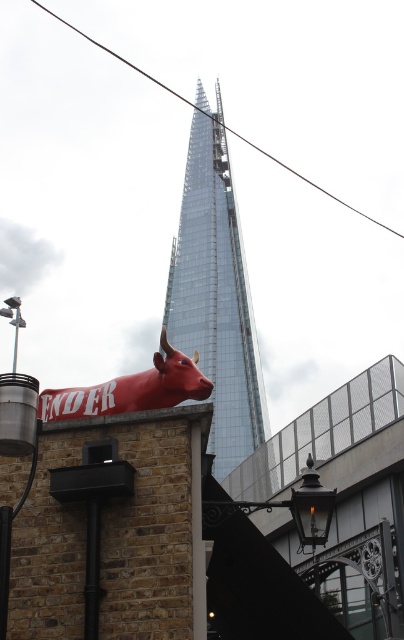
You are standing at the base of the transparent glass skyscraper at center. Looking up, you notice a point marked at coordinates (216, 291). What does this point represent?

The point at coordinates (216, 291) marks the transparent glass skyscraper at center.

You are standing in front of the transparent glass skyscraper at center. If you want to take a photo of the entire building without moving your position, will you be able to capture it all in one frame?

The transparent glass skyscraper at center is 21.14 meters away from the camera. Since the question does not provide information about the camera sensor size or lens focal length, it is impossible to determine if the entire building can be captured in one frame without moving your position.

You are an architect standing at the base of the transparent glass skyscraper at center and want to take a photo of the shiny red bull at lower left. Which object should you move closer to in order to capture both in the same frame?

You should move closer to the shiny red bull at lower left because the transparent glass skyscraper at center is further away, so reducing the distance between yourself and the closer object will help include both in the frame.